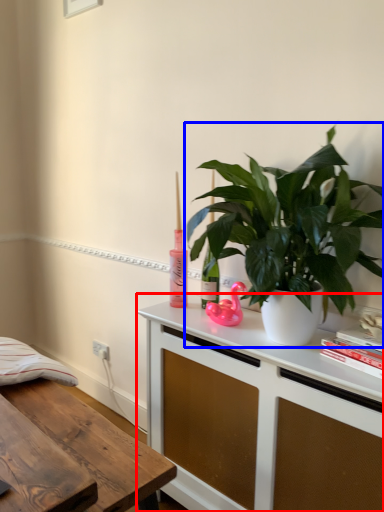
Question: Which object appears closest to the camera in this image, cabinetry (highlighted by a red box) or houseplant (highlighted by a blue box)?

Choices:
 (A) cabinetry
 (B) houseplant

Answer: (B)